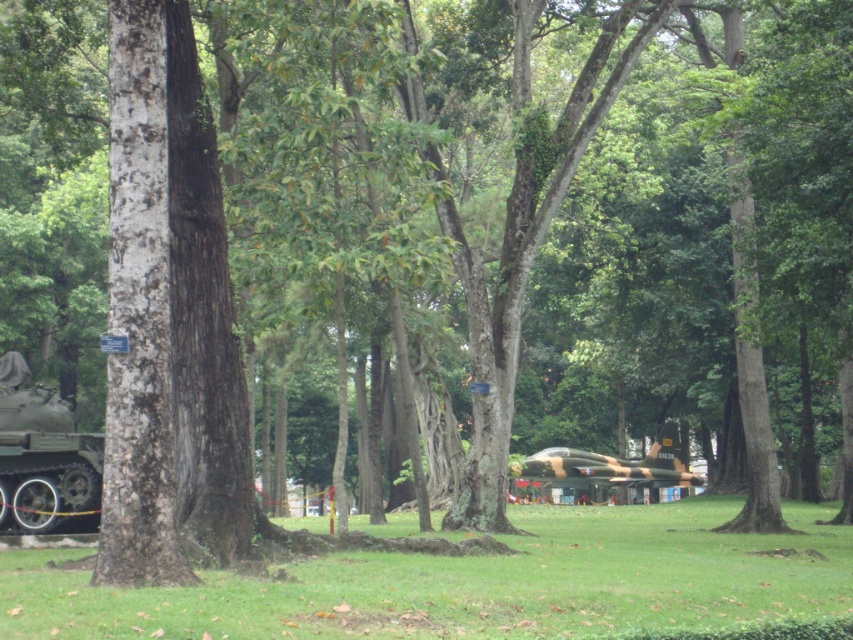
Question: Is matte green tank at left smaller than camouflage paint tank at center?

Choices:
 (A) yes
 (B) no

Answer: (A)

Question: Does matte green tank at left appear on the right side of camouflage paint tank at center?

Choices:
 (A) no
 (B) yes

Answer: (A)

Question: In this image, where is matte green tank at left located relative to camouflage paint tank at center?

Choices:
 (A) left
 (B) right

Answer: (A)

Question: Which point is farther to the camera?

Choices:
 (A) (62, 433)
 (B) (677, 464)

Answer: (B)

Question: Which point is farther to the camera?

Choices:
 (A) (646, 492)
 (B) (16, 465)

Answer: (A)